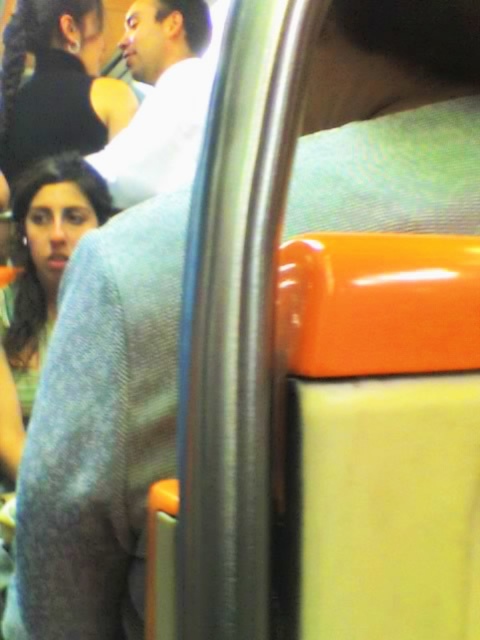
You are a passenger on a moving bus and want to sit down. You see a person with the matte black hair at upper left and another wearing a white cotton shirt at upper center. Which person is closer to you?

The matte black hair at upper left is closer to you because it is further to the viewer than the white cotton shirt at upper center.

You are a passenger on a moving bus and you want to know if the point at coordinate (84, 122) is closer to you than the point at coordinate (204, 97). Can you confirm this?

Yes, the point at coordinate (84, 122) is closer to you than the point at coordinate (204, 97) because it is further to the camera.